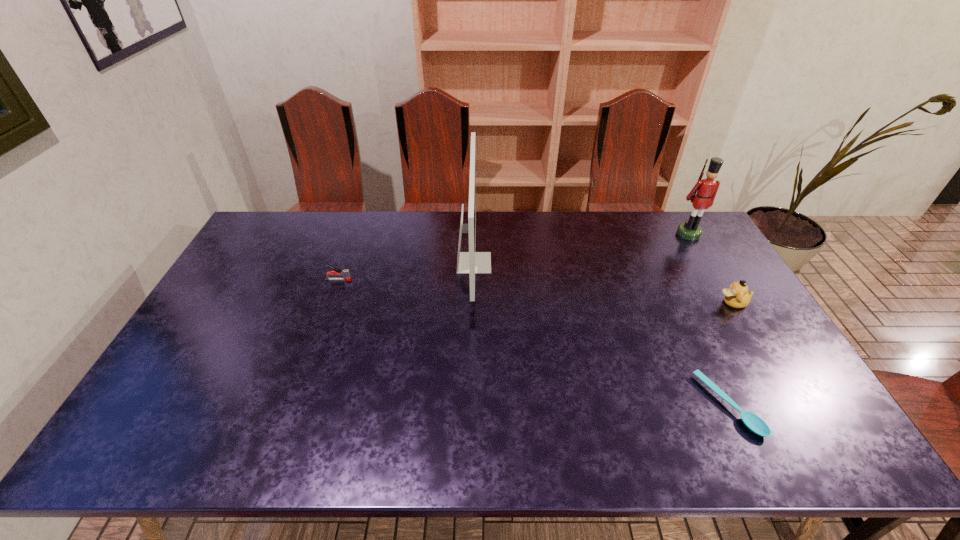
Find the location of `free space located on the face of the third tallest object`. free space located on the face of the third tallest object is located at coordinates (661, 303).

The width and height of the screenshot is (960, 540). In order to click on vacant space located 0.080m on the face of the third tallest object in this screenshot , I will do `click(691, 303)`.

The height and width of the screenshot is (540, 960). Find the location of `blank space located 0.120m on the handle side of the leftmost object`. blank space located 0.120m on the handle side of the leftmost object is located at coordinates (388, 280).

Image resolution: width=960 pixels, height=540 pixels. I want to click on free space located 0.060m on the right of the spoon, so click(x=777, y=405).

You are a GUI agent. You are given a task and a screenshot of the screen. Output one action in this format:
    pyautogui.click(x=<x>, y=<y>)
    Task: Click on the monitor positioned at the far edge
    This screenshot has width=960, height=540.
    Given the screenshot: What is the action you would take?
    pyautogui.click(x=471, y=262)

This screenshot has height=540, width=960. Identify the location of nutcracker situated at the far edge. (706, 189).

Where is `object situated at the near edge`? The image size is (960, 540). object situated at the near edge is located at coordinates (753, 422).

This screenshot has width=960, height=540. I want to click on nutcracker at the right edge, so click(x=706, y=189).

This screenshot has height=540, width=960. Identify the location of duckling present at the right edge. (737, 296).

I want to click on spoon that is at the right edge, so click(753, 422).